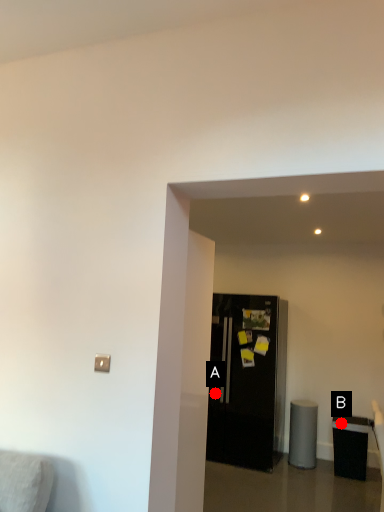
Question: Two points are circled on the image, labeled by A and B beside each circle. Which point is farther to the camera?

Choices:
 (A) A is further
 (B) B is further

Answer: (A)